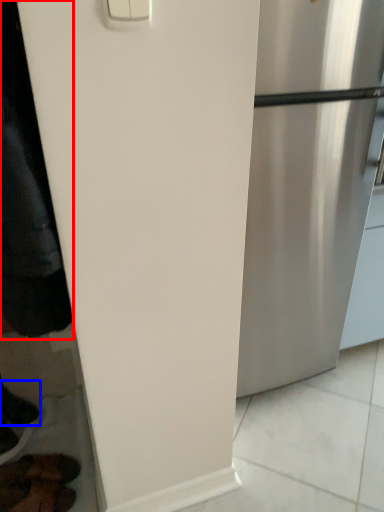
Question: Which point is further to the camera, jacket (highlighted by a red box) or shoe (highlighted by a blue box)?

Choices:
 (A) jacket
 (B) shoe

Answer: (B)